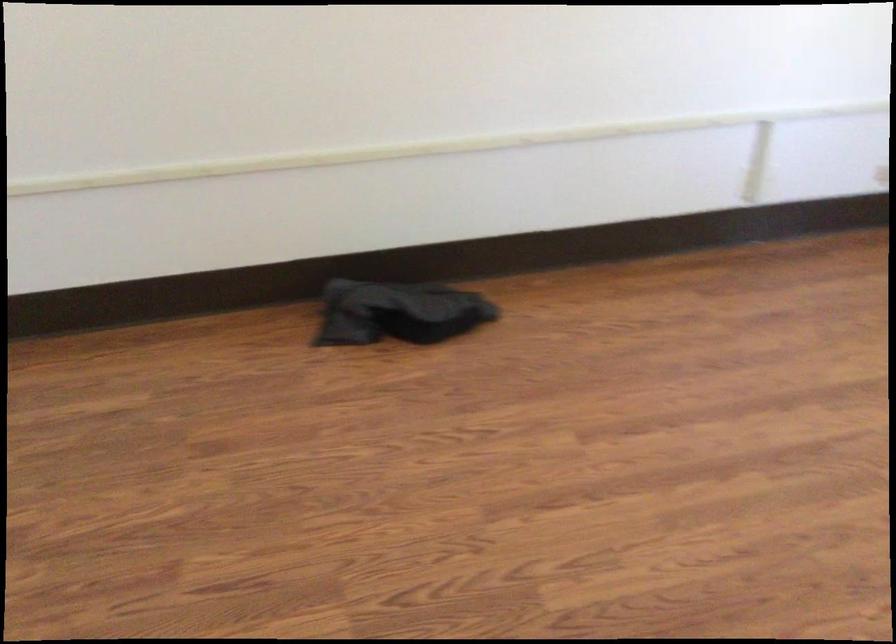
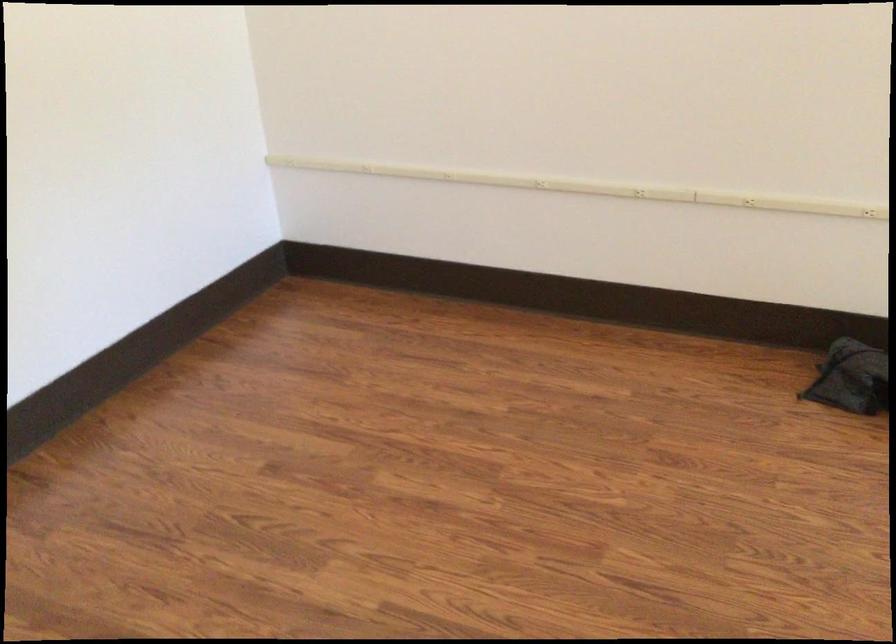
The point at (x=202, y=172) is marked in the first image. Where is the corresponding point in the second image?

(747, 202)